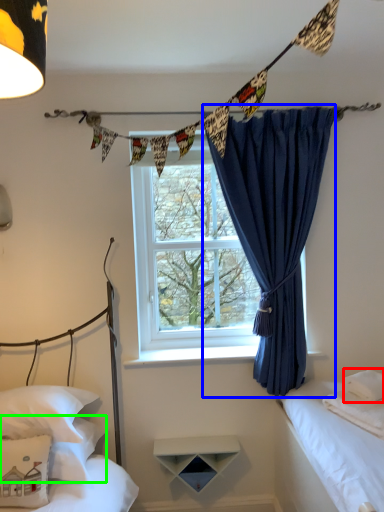
Question: Which object is the closest to the pillow (highlighted by a red box)? Choose among these: curtain (highlighted by a blue box) or pillow (highlighted by a green box).

Choices:
 (A) curtain
 (B) pillow

Answer: (A)